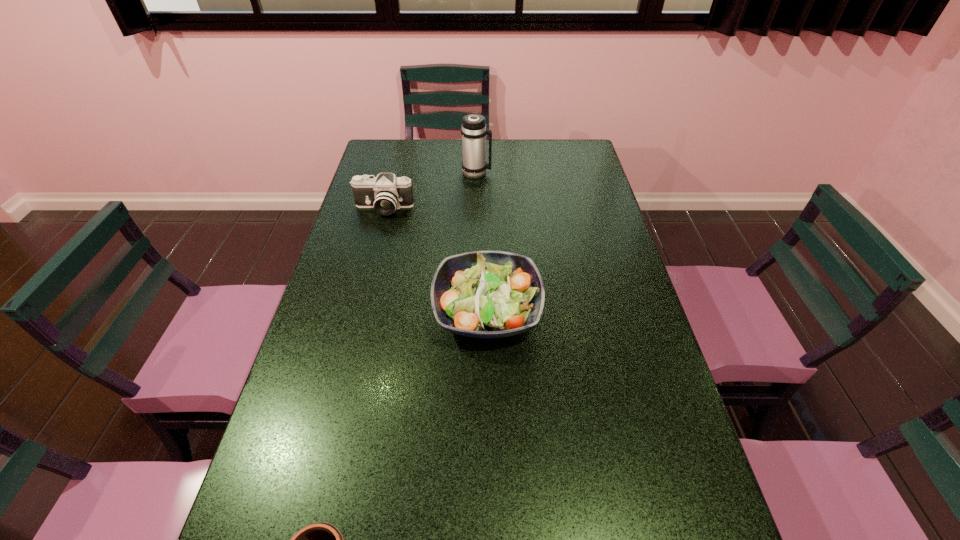
Where is `vacant space at the left edge of the desktop`? This screenshot has width=960, height=540. vacant space at the left edge of the desktop is located at coordinates (347, 433).

Find the location of `vacant space at the right edge of the desktop`. vacant space at the right edge of the desktop is located at coordinates (604, 272).

Locate an element on the screen. The height and width of the screenshot is (540, 960). free space at the far right corner of the desktop is located at coordinates (575, 166).

Identify the location of unoccupied area between the third nearest object and the salad plate. (435, 260).

The height and width of the screenshot is (540, 960). I want to click on free spot between the tallest object and the camera, so click(430, 190).

The image size is (960, 540). I want to click on free spot between the third farthest object and the tallest object, so click(x=482, y=242).

In order to click on vacant area that lies between the third nearest object and the salad plate in this screenshot , I will do (x=435, y=260).

I want to click on object that is the third nearest to the camera, so click(320, 539).

Identify the location of object that stands as the closest to the mug. (482, 294).

The height and width of the screenshot is (540, 960). I want to click on free spot that satisfies the following two spatial constraints: 1. on the side with the handle of the second nearest object; 2. on the left side of the farthest object, so click(x=475, y=311).